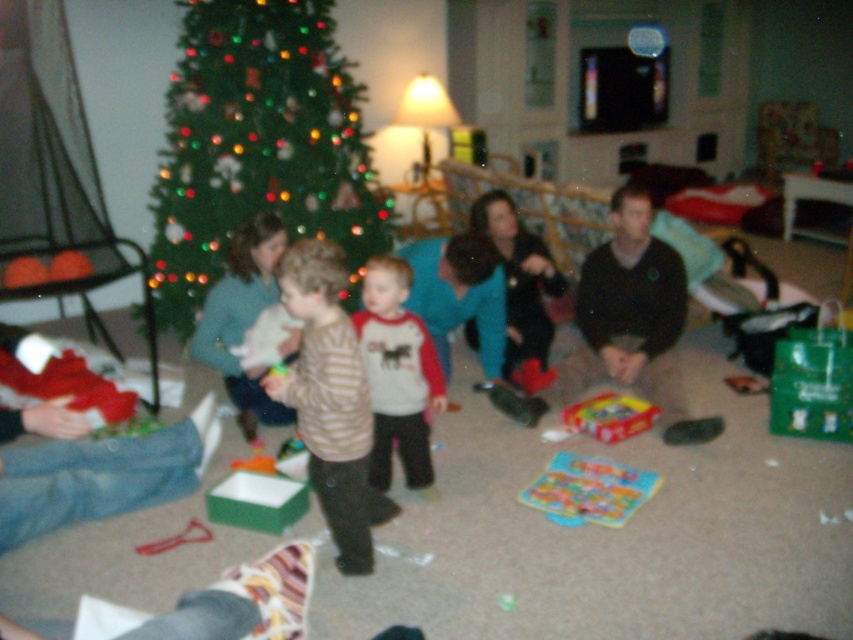
You are a guest at the Christmas gathering and want to take a photo of the striped sweater at center without including the green matte christmas tree at upper left in the frame. Is it possible to do so by moving closer to the sweater?

The green matte christmas tree at upper left is further to the viewer than striped sweater at center, so moving closer to the sweater would bring it into focus while the tree might still be visible in the background. To exclude the tree, you might need to adjust your angle or move sideways rather than just forward.

You are standing in the living room and want to hand a gift to the person wearing the striped cotton shirt at center. However, you are currently facing the black sweater at center. Can you directly hand the gift without moving your position?

The black sweater at center is further to the viewer than striped cotton shirt at center, so you can directly hand the gift to the striped cotton shirt at center without moving your position because the black sweater at center is closer to you, allowing you to reach them while facing it.